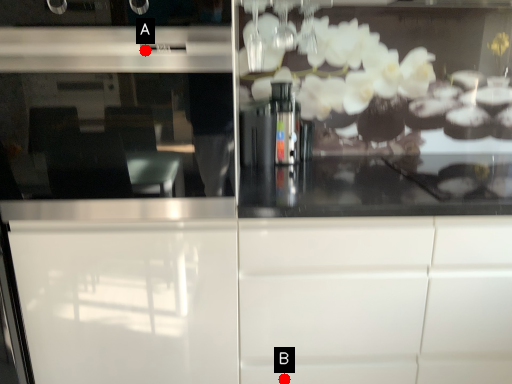
Question: Two points are circled on the image, labeled by A and B beside each circle. Which point is closer to the camera?

Choices:
 (A) A is closer
 (B) B is closer

Answer: (A)